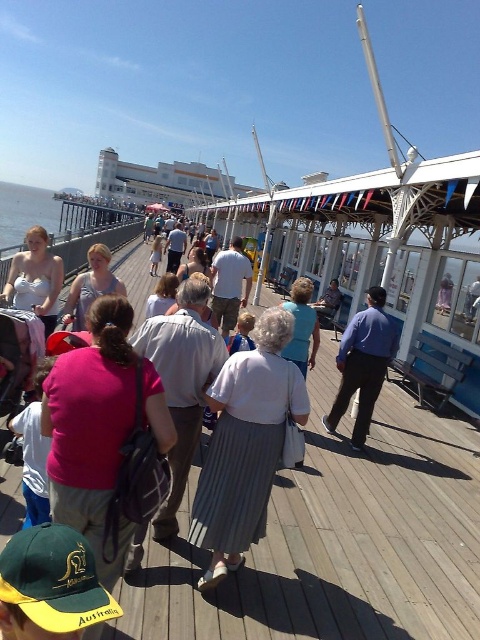
Question: Which point is farther to the camera?

Choices:
 (A) (109, 285)
 (B) (328, 289)

Answer: (B)

Question: Is white cotton shirt at center closer to camera compared to matte white shirt at center?

Choices:
 (A) yes
 (B) no

Answer: (B)

Question: Which point is closer to the camera taking this photo?

Choices:
 (A) (278, 365)
 (B) (442, 285)
 (C) (226, 284)

Answer: (A)

Question: Is blue denim shirt at center closer to camera compared to light blue fabric at center?

Choices:
 (A) no
 (B) yes

Answer: (A)

Question: Is clear blue water at pier left positioned in front of matte white shirt at center?

Choices:
 (A) no
 (B) yes

Answer: (A)

Question: Which of the following is the closest to the observer?

Choices:
 (A) (0, 205)
 (B) (218, 624)
 (C) (37, 230)
 (D) (224, 536)

Answer: (B)